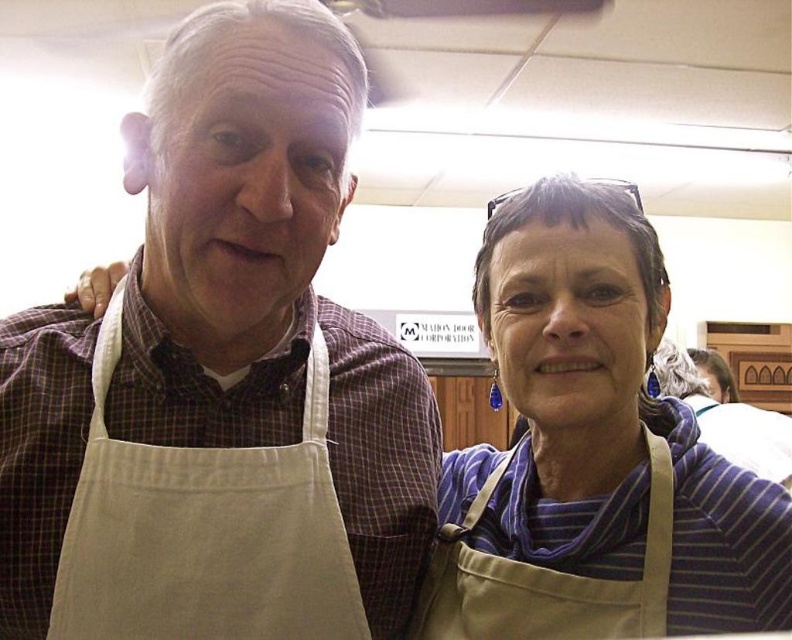
You are an observer standing in front of the two people in the image. Which apron, the matte beige apron at center or the beige cotton apron at left, is closer to you?

The matte beige apron at center is closer to you because the beige cotton apron at left is behind it.